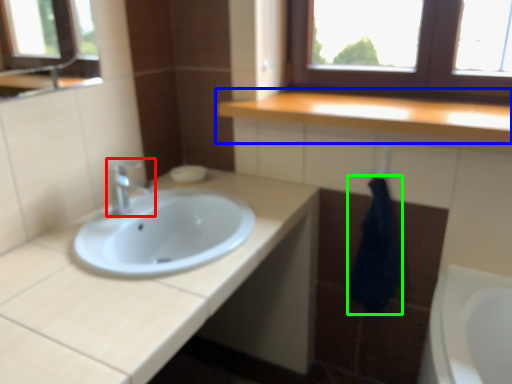
Question: Which object is positioned farthest from tap (highlighted by a red box)? Select from countertop (highlighted by a blue box) and bath towel (highlighted by a green box).

Choices:
 (A) countertop
 (B) bath towel

Answer: (B)